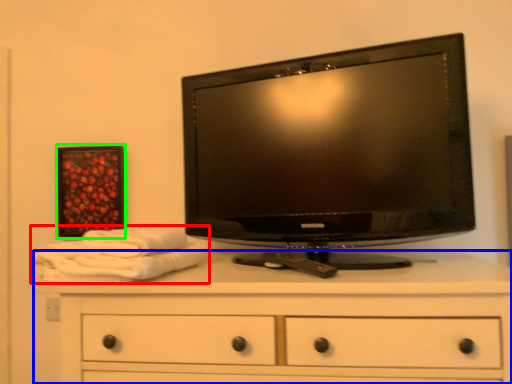
Question: Which object is positioned closest to bath towel (highlighted by a red box)? Select from chest of drawers (highlighted by a blue box) and picture frame (highlighted by a green box).

Choices:
 (A) chest of drawers
 (B) picture frame

Answer: (A)